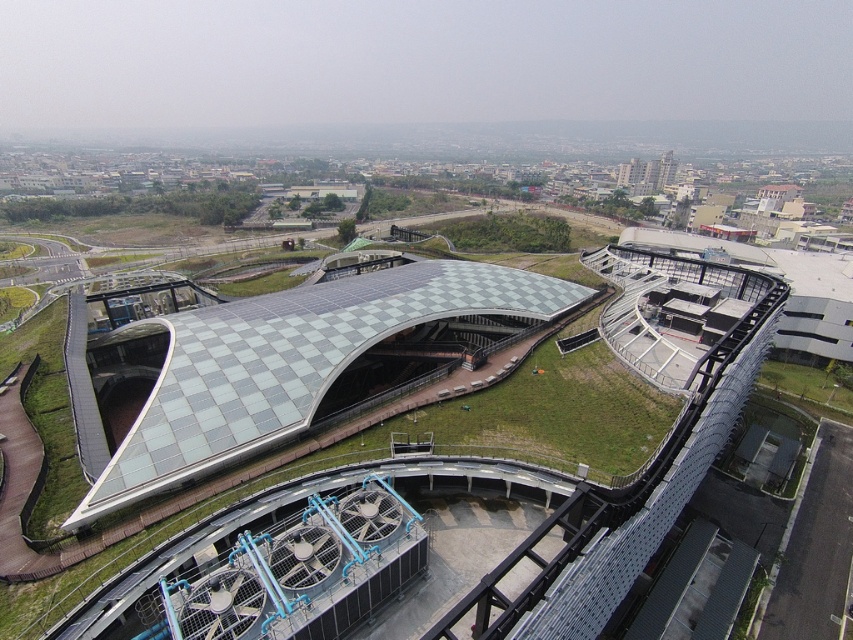
What are the coordinates of the checkered glass roof at center?

The checkered glass roof at center is located at coordinates point (289, 365).

You are standing at the point with coordinates point (289, 365) in the image. What is the name of the object located exactly at this point?

The point (289, 365) indicates checkered glass roof at center.

You are a visitor standing at the entrance of the building and looking towards the checkered glass roof at center and the green grass at lower right. Which object is positioned to the left from your viewpoint?

The checkered glass roof at center is positioned to the left of green grass at lower right from your viewpoint.